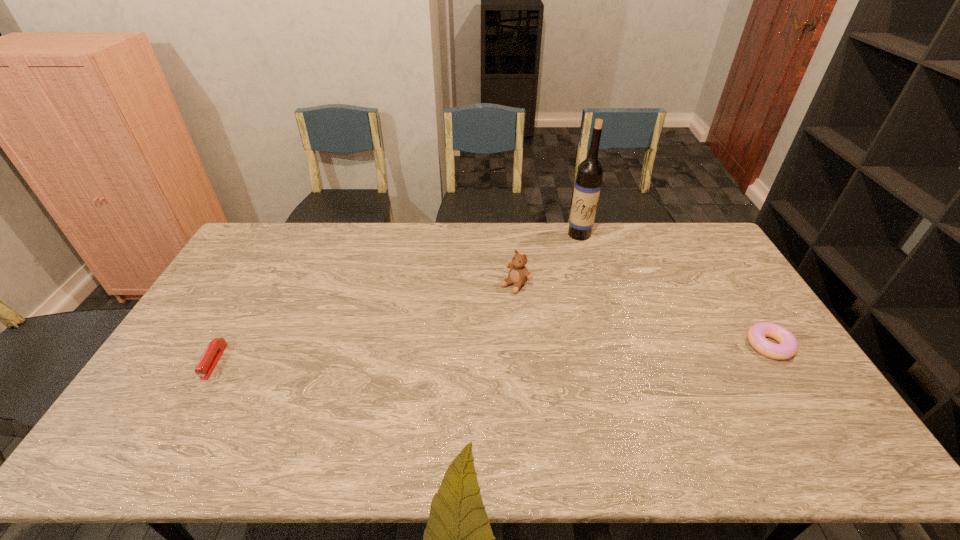
Where is `vacant area situated 0.270m on the label of the third object from left to right`? vacant area situated 0.270m on the label of the third object from left to right is located at coordinates [x=559, y=285].

I want to click on vacant space situated 0.160m on the front-facing side of the teddy bear, so click(474, 320).

The width and height of the screenshot is (960, 540). I want to click on free space located on the front-facing side of the teddy bear, so click(x=447, y=342).

Identify the location of blank space located 0.330m on the front-facing side of the teddy bear. (435, 353).

I want to click on object at the far edge, so click(587, 188).

The image size is (960, 540). I want to click on object that is at the left edge, so click(x=207, y=363).

In order to click on object positioned at the right edge in this screenshot , I will do 788,345.

Where is `vacant space at the far edge of the desktop`? vacant space at the far edge of the desktop is located at coordinates (652, 231).

The image size is (960, 540). In the image, there is a desktop. In order to click on free space at the near edge in this screenshot , I will do `click(401, 411)`.

Locate an element on the screen. This screenshot has height=540, width=960. vacant region at the left edge of the desktop is located at coordinates (242, 294).